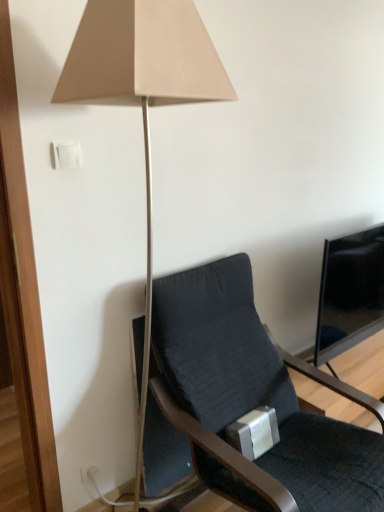
Describe the element at coordinates (350, 292) in the screenshot. I see `black glossy screen at right` at that location.

Locate an element on the screen. The height and width of the screenshot is (512, 384). black glossy screen at right is located at coordinates (350, 292).

Locate an element on the screen. matte beige lamp at upper center is located at coordinates (142, 89).

I want to click on black glossy screen at right, so click(x=350, y=292).

From the image's perspective, is dark gray fabric chair at center on top of white plastic light switch at upper left?

Incorrect, from the image's perspective, dark gray fabric chair at center is lower than white plastic light switch at upper left.

Considering the relative positions of dark gray fabric chair at center and white plastic light switch at upper left in the image provided, is dark gray fabric chair at center behind white plastic light switch at upper left?

No, it is not.

From a real-world perspective, who is located lower, dark gray fabric chair at center or white plastic light switch at upper left?

dark gray fabric chair at center, from a real-world perspective.

Between point (158, 58) and point (168, 382), which one is positioned in front?

The point (158, 58) is more forward.

Is matte beige lamp at upper center spatially inside dark gray fabric chair at center, or outside of it?

matte beige lamp at upper center is not inside dark gray fabric chair at center, it's outside.

Is matte beige lamp at upper center oriented towards dark gray fabric chair at center?

No, matte beige lamp at upper center is not turned towards dark gray fabric chair at center.

Which is behind, matte beige lamp at upper center or black glossy screen at right?

black glossy screen at right is behind.

From a real-world perspective, who is located higher, matte beige lamp at upper center or black glossy screen at right?

matte beige lamp at upper center, from a real-world perspective.

Does matte beige lamp at upper center have a greater height compared to black glossy screen at right?

Yes.

You are a GUI agent. You are given a task and a screenshot of the screen. Output one action in this format:
    pyautogui.click(x=<x>, y=<y>)
    Task: Click on the lamp below the black glossy screen at right (from the image's perspective)
    Image resolution: width=384 pixels, height=512 pixels.
    Given the screenshot: What is the action you would take?
    pyautogui.click(x=142, y=89)

Consider the image. Relative to matte beige lamp at upper center, is white plastic light switch at upper left in front or behind?

Clearly, white plastic light switch at upper left is behind matte beige lamp at upper center.

This screenshot has height=512, width=384. I want to click on light switch above the matte beige lamp at upper center (from the image's perspective), so click(x=65, y=154).

Considering the sizes of objects white plastic light switch at upper left and matte beige lamp at upper center in the image provided, who is wider, white plastic light switch at upper left or matte beige lamp at upper center?

matte beige lamp at upper center is wider.

Considering the positions of objects white plastic light switch at upper left and matte beige lamp at upper center in the image provided, who is more to the left, white plastic light switch at upper left or matte beige lamp at upper center?

white plastic light switch at upper left.

From the image's perspective, is black glossy screen at right positioned above or below dark gray fabric chair at center?

black glossy screen at right is above dark gray fabric chair at center.

Which object is wider, black glossy screen at right or dark gray fabric chair at center?

With larger width is dark gray fabric chair at center.

Locate an element on the screen. Image resolution: width=384 pixels, height=512 pixels. chair in front of the black glossy screen at right is located at coordinates (245, 404).

Is black glossy screen at right beside dark gray fabric chair at center?

No, black glossy screen at right is not making contact with dark gray fabric chair at center.

Can we say black glossy screen at right lies outside white plastic light switch at upper left?

Indeed, black glossy screen at right is completely outside white plastic light switch at upper left.

Is black glossy screen at right facing towards white plastic light switch at upper left?

No, black glossy screen at right is not oriented towards white plastic light switch at upper left.

In terms of height, does black glossy screen at right look taller or shorter compared to white plastic light switch at upper left?

Considering their sizes, black glossy screen at right has more height than white plastic light switch at upper left.

Locate an element on the screen. The image size is (384, 512). light switch that is above the black glossy screen at right (from a real-world perspective) is located at coordinates (65, 154).

Would you say matte beige lamp at upper center is to the left or to the right of white plastic light switch at upper left in the picture?

From the image, it's evident that matte beige lamp at upper center is to the right of white plastic light switch at upper left.

Is matte beige lamp at upper center oriented away from white plastic light switch at upper left?

Absolutely, matte beige lamp at upper center is directed away from white plastic light switch at upper left.

In the scene shown: Is matte beige lamp at upper center inside or outside of white plastic light switch at upper left?

matte beige lamp at upper center is located beyond the bounds of white plastic light switch at upper left.

Does matte beige lamp at upper center have a smaller size compared to white plastic light switch at upper left?

No.

Where is `light switch located on the left of dark gray fabric chair at center`? This screenshot has width=384, height=512. light switch located on the left of dark gray fabric chair at center is located at coordinates (65, 154).

You are a GUI agent. You are given a task and a screenshot of the screen. Output one action in this format:
    pyautogui.click(x=<x>, y=<y>)
    Task: Click on the chair below the matte beige lamp at upper center (from the image's perspective)
    Image resolution: width=384 pixels, height=512 pixels.
    Given the screenshot: What is the action you would take?
    pyautogui.click(x=245, y=404)

When comparing their distances from black glossy screen at right, does dark gray fabric chair at center or white plastic light switch at upper left seem closer?

dark gray fabric chair at center is closer to black glossy screen at right.

Looking at this image, based on their spatial positions, is matte beige lamp at upper center or dark gray fabric chair at center further from white plastic light switch at upper left?

The object further to white plastic light switch at upper left is dark gray fabric chair at center.

When comparing their distances from black glossy screen at right, does dark gray fabric chair at center or matte beige lamp at upper center seem closer?

Based on the image, dark gray fabric chair at center appears to be nearer to black glossy screen at right.

Based on their spatial positions, is black glossy screen at right or white plastic light switch at upper left closer to matte beige lamp at upper center?

Based on the image, white plastic light switch at upper left appears to be nearer to matte beige lamp at upper center.

When comparing their distances from dark gray fabric chair at center, does matte beige lamp at upper center or white plastic light switch at upper left seem closer?

The object closer to dark gray fabric chair at center is matte beige lamp at upper center.

Which object lies nearer to the anchor point dark gray fabric chair at center, black glossy screen at right or white plastic light switch at upper left?

black glossy screen at right.

Consider the image. Based on their spatial positions, is matte beige lamp at upper center or white plastic light switch at upper left closer to black glossy screen at right?

The object closer to black glossy screen at right is matte beige lamp at upper center.

Looking at the image, which one is located further to white plastic light switch at upper left, black glossy screen at right or dark gray fabric chair at center?

The object further to white plastic light switch at upper left is black glossy screen at right.

This screenshot has width=384, height=512. Identify the location of chair located between white plastic light switch at upper left and black glossy screen at right in the left-right direction. (245, 404).

Identify the location of chair between matte beige lamp at upper center and black glossy screen at right from front to back. (245, 404).

Find the location of `lamp situated between white plastic light switch at upper left and black glossy screen at right from left to right`. lamp situated between white plastic light switch at upper left and black glossy screen at right from left to right is located at coordinates (142, 89).

The width and height of the screenshot is (384, 512). I want to click on lamp between white plastic light switch at upper left and dark gray fabric chair at center in the up-down direction, so click(x=142, y=89).